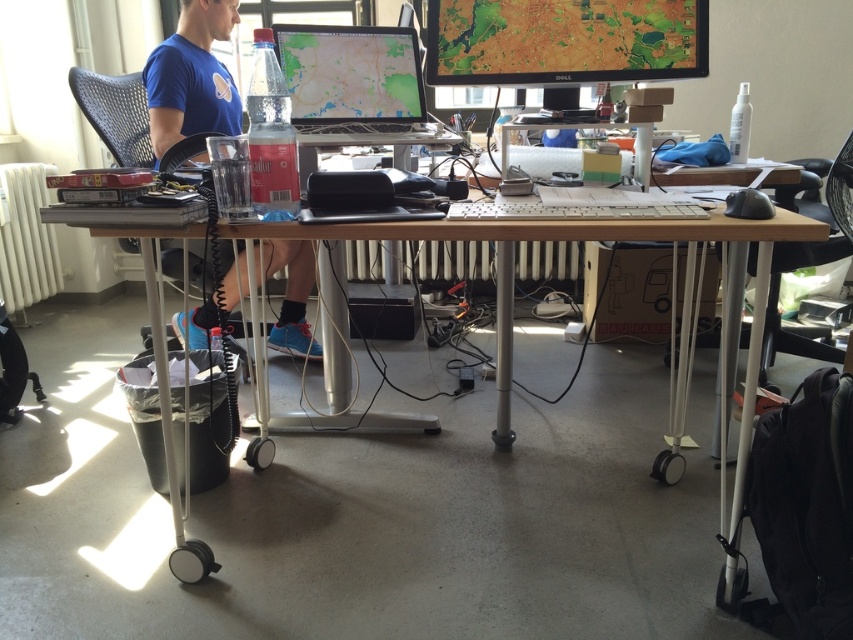
Question: Among these objects, which one is farthest from the camera?

Choices:
 (A) matte plastic monitor at center
 (B) black plastic chair at right
 (C) matte plastic monitor at upper center
 (D) wooden desk at center

Answer: (B)

Question: Based on their relative distances, which object is farther from the blue cotton shirt at upper left?

Choices:
 (A) black plastic chair at right
 (B) wooden desk at center
 (C) matte plastic monitor at upper center
 (D) matte plastic monitor at center

Answer: (A)

Question: Can you confirm if matte plastic monitor at upper center is positioned to the left of blue cotton shirt at upper left?

Choices:
 (A) yes
 (B) no

Answer: (B)

Question: Does matte plastic monitor at center appear on the right side of black plastic chair at right?

Choices:
 (A) no
 (B) yes

Answer: (A)

Question: Which point appears closest to the camera in this image?

Choices:
 (A) (490, 24)
 (B) (299, 268)
 (C) (802, 244)

Answer: (A)

Question: Does blue cotton shirt at upper left appear on the left side of matte plastic monitor at center?

Choices:
 (A) no
 (B) yes

Answer: (B)